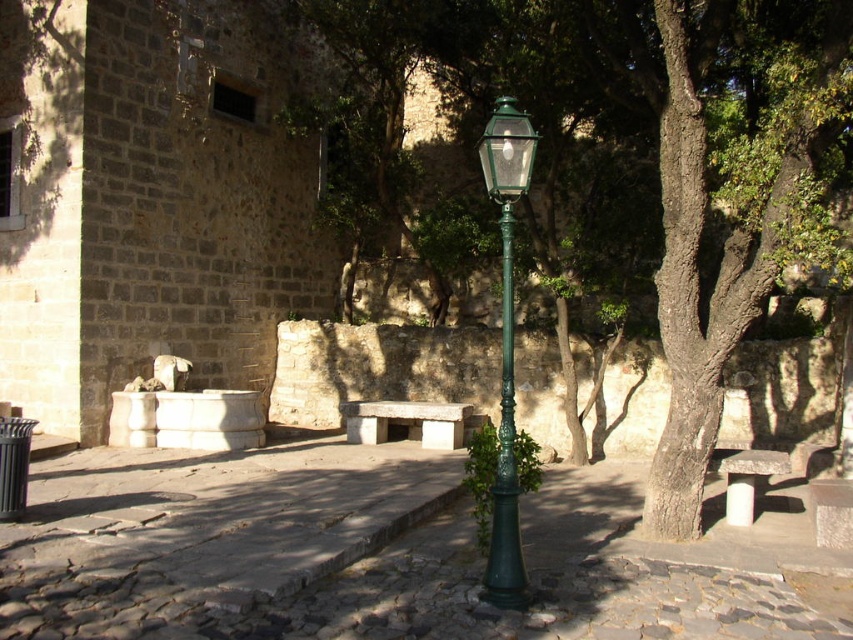
Measure the distance between white stone bench at center and smooth stone bench at lower right.

5.77 meters

Is white stone bench at center above smooth stone bench at lower right?

Correct, white stone bench at center is located above smooth stone bench at lower right.

This screenshot has height=640, width=853. I want to click on white stone bench at center, so click(x=405, y=419).

Does green textured tree at center lie behind smooth stone bench at lower right?

No.

Is green textured tree at center taller than smooth stone bench at lower right?

Correct, green textured tree at center is much taller as smooth stone bench at lower right.

What do you see at coordinates (701, 168) in the screenshot? I see `green textured tree at center` at bounding box center [701, 168].

The image size is (853, 640). What are the coordinates of `green textured tree at center` in the screenshot? It's located at (701, 168).

Does green textured tree at center have a greater width compared to green polished metal street light at center?

Indeed, green textured tree at center has a greater width compared to green polished metal street light at center.

Between green textured tree at center and green polished metal street light at center, which one has less height?

Standing shorter between the two is green polished metal street light at center.

Find the location of a particular element. Image resolution: width=853 pixels, height=640 pixels. green textured tree at center is located at coordinates pos(701,168).